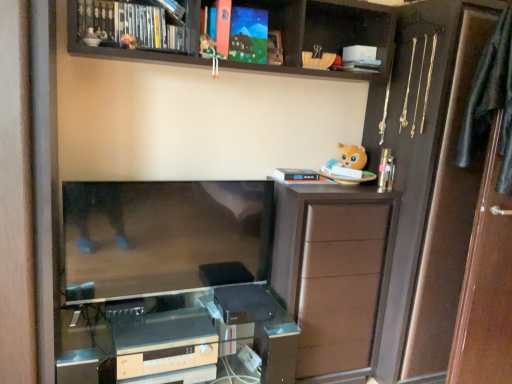
Image resolution: width=512 pixels, height=384 pixels. I want to click on empty space that is ontop of brown matte cabinet at right (from a real-world perspective), so click(x=328, y=183).